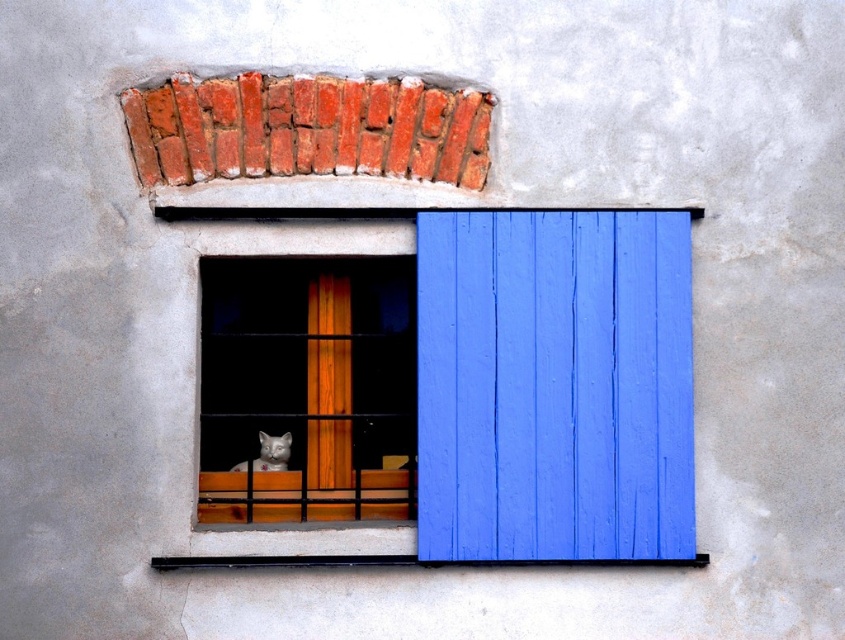
You are an architect designing a new building facade and want to place a decorative cat figurine on a window ledge. Given the scene described, can the white fur cat at window center fit on the wooden window frame at center without overlapping its edges?

The wooden window frame at center is wider than the white fur cat at window center, so the cat can fit on the wooden window frame at center without overlapping its edges.

You are a painter who needs to know the relative sizes of the wooden window frame at center and the white fur cat at window center for your artwork. Which object is taller?

The wooden window frame at center is taller than the white fur cat at window center according to the description.

You are an interior designer observing the exterior wall of a building. You notice the blue painted wood at right and the white fur cat at window center. Which object is located to the right of the other?

The blue painted wood at right is positioned on the right side of white fur cat at window center.